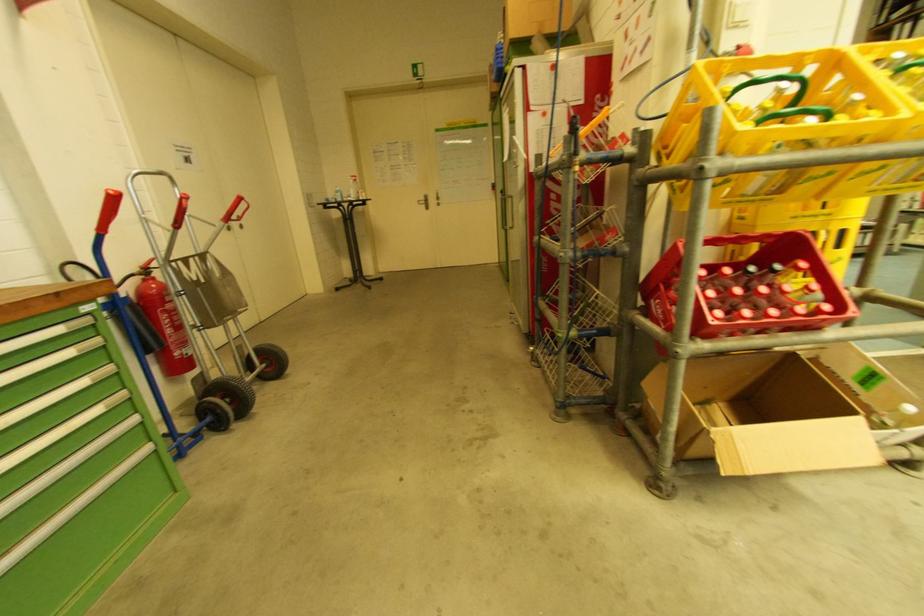
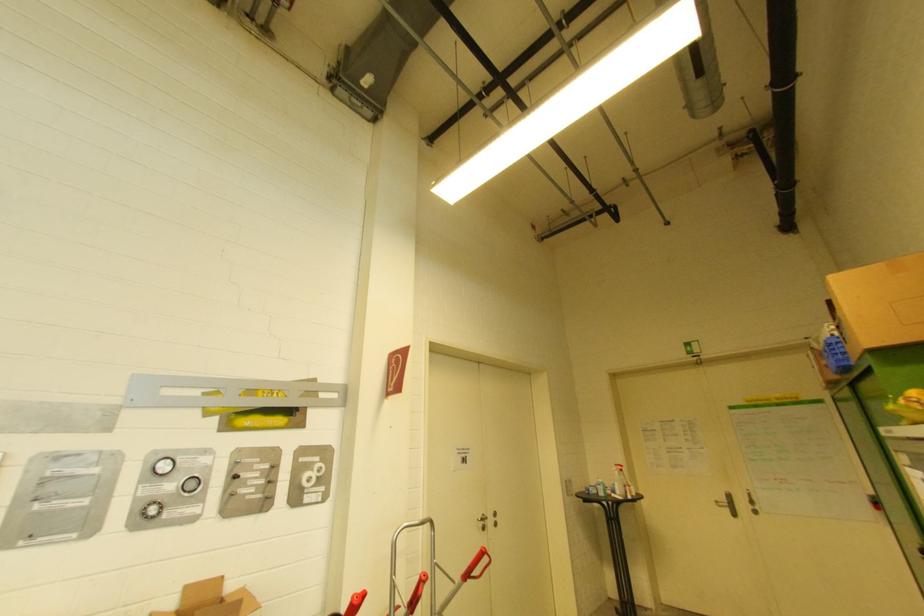
In the second image, find the point that corresponds to point (235, 220) in the first image.

(475, 575)